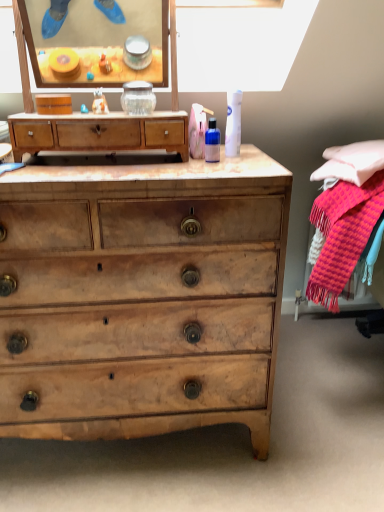
This screenshot has width=384, height=512. In order to click on vacant space in front of translucent plastic bottle at center, positioned as the first toiletry in left-to-right order in this screenshot , I will do 218,166.